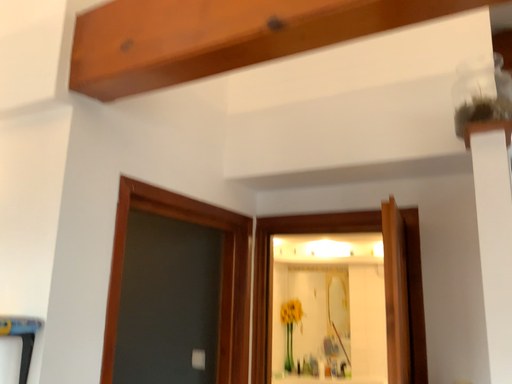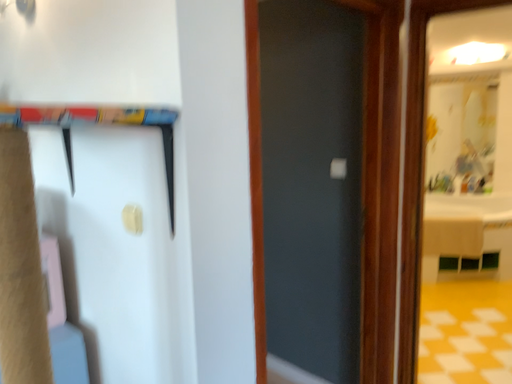
Question: Which way did the camera rotate in the video?

Choices:
 (A) rotated left
 (B) rotated right

Answer: (A)